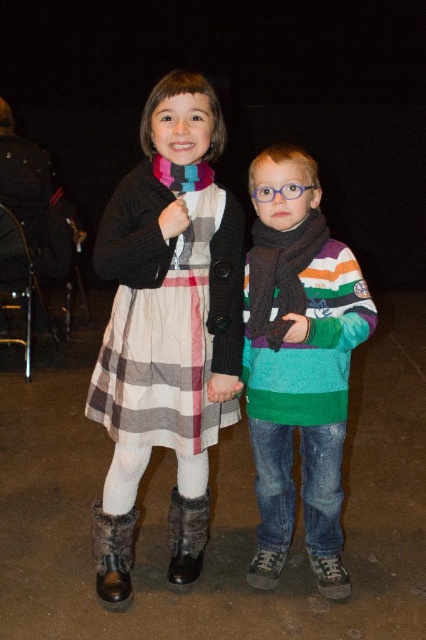
Question: Is brown woolen scarf at center to the left of black fuzzy boot at lower center from the viewer's perspective?

Choices:
 (A) yes
 (B) no

Answer: (B)

Question: Which object appears closest to the camera in this image?

Choices:
 (A) multicolored knitted scarf at center
 (B) brown woolen scarf at center
 (C) black fuzzy boot at lower center
 (D) plaid cotton dress at center

Answer: (D)

Question: Which object is closer to the camera taking this photo?

Choices:
 (A) black fuzzy boot at lower center
 (B) plaid cotton dress at center

Answer: (B)

Question: Where is striped sweater at center located in relation to plaid cotton dress at center in the image?

Choices:
 (A) above
 (B) below

Answer: (B)

Question: Does striped sweater at center appear on the right side of plaid cotton dress at center?

Choices:
 (A) no
 (B) yes

Answer: (B)

Question: Considering the real-world distances, which object is closest to the striped sweater at center?

Choices:
 (A) multicolored knitted scarf at center
 (B) plaid cotton dress at center
 (C) black fuzzy boot at lower center
 (D) brown woolen scarf at center

Answer: (D)